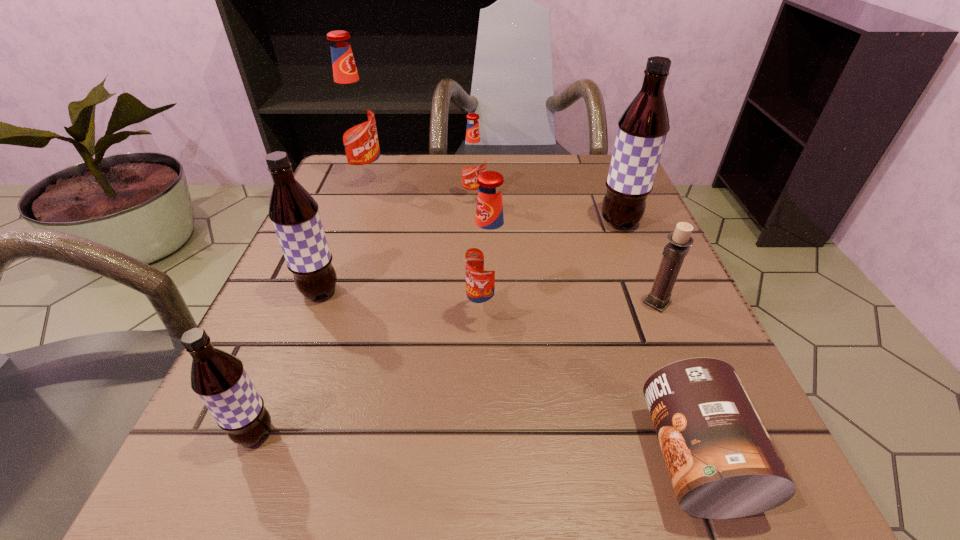
The width and height of the screenshot is (960, 540). Identify the location of vacant region located 0.180m on the front label of the can. (493, 457).

The height and width of the screenshot is (540, 960). Identify the location of vacant area situated 0.070m on the front label of the can. (588, 457).

At what (x,y) coordinates should I click in order to perform the action: click on root beer that is at the near edge. Please return your answer as a coordinate pair (x, y). Looking at the image, I should click on (219, 379).

This screenshot has height=540, width=960. Identify the location of can positioned at the near edge. (723, 464).

Locate an element on the screen. This screenshot has height=540, width=960. root beer present at the right edge is located at coordinates (642, 129).

The height and width of the screenshot is (540, 960). Identify the location of candle holder that is at the right edge. (674, 252).

Identify the location of can at the right edge. (723, 464).

Where is `object situated at the far left corner`? object situated at the far left corner is located at coordinates (353, 116).

Identify the location of object at the near left corner. The width and height of the screenshot is (960, 540). (219, 379).

This screenshot has width=960, height=540. What are the coordinates of `object that is at the far right corner` in the screenshot? It's located at (642, 129).